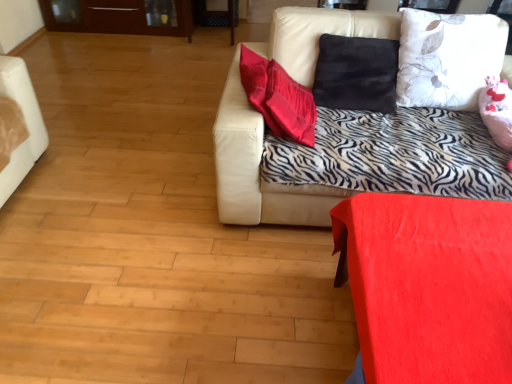
This screenshot has width=512, height=384. Identify the location of leather couch at upper right. (258, 170).

Find the location of a particular element. This screenshot has width=512, height=384. matte red table at lower right is located at coordinates (428, 286).

Locate an element on the screen. The height and width of the screenshot is (384, 512). white floral fabric pillow at upper right is located at coordinates (447, 58).

Between matte red table at lower right and white floral fabric pillow at upper right, which one appears on the left side from the viewer's perspective?

matte red table at lower right is more to the left.

Considering their positions, is matte red table at lower right located in front of or behind white floral fabric pillow at upper right?

In the image, matte red table at lower right appears in front of white floral fabric pillow at upper right.

Identify the location of furniture located below the white floral fabric pillow at upper right (from the image's perspective). (428, 286).

Would you consider matte red table at lower right to be distant from white floral fabric pillow at upper right?

No.

From the image's perspective, is white floral fabric pillow at upper right over leather couch at upper right?

Yes, from the image's perspective, white floral fabric pillow at upper right is above leather couch at upper right.

Find the location of `pillow located on the right of leather couch at upper right`. pillow located on the right of leather couch at upper right is located at coordinates (447, 58).

Consider the image. From a real-world perspective, between white floral fabric pillow at upper right and leather couch at upper right, who is vertically higher?

In real-world perspective, white floral fabric pillow at upper right is above.

Which of these two, matte red table at lower right or leather couch at upper right, is wider?

With larger width is leather couch at upper right.

Which is nearer, (374, 251) or (277, 40)?

Point (374, 251) is positioned closer to the camera compared to point (277, 40).

From a real-world perspective, between matte red table at lower right and leather couch at upper right, who is vertically higher?

leather couch at upper right is physically above.

At what (x,y) coordinates should I click in order to perform the action: click on studio couch lying above the matte red table at lower right (from the image's perspective). Please return your answer as a coordinate pair (x, y). Looking at the image, I should click on (258, 170).

From a real-world perspective, which is physically below, leather couch at upper right or white floral fabric pillow at upper right?

leather couch at upper right.

Can you confirm if leather couch at upper right is positioned to the left of white floral fabric pillow at upper right?

Yes, leather couch at upper right is to the left of white floral fabric pillow at upper right.

From their relative heights in the image, would you say leather couch at upper right is taller or shorter than white floral fabric pillow at upper right?

leather couch at upper right is taller than white floral fabric pillow at upper right.

Is white floral fabric pillow at upper right wider or thinner than matte red table at lower right?

white floral fabric pillow at upper right is thinner than matte red table at lower right.

Considering the positions of objects white floral fabric pillow at upper right and matte red table at lower right in the image provided, who is more to the left, white floral fabric pillow at upper right or matte red table at lower right?

From the viewer's perspective, matte red table at lower right appears more on the left side.

How different are the orientations of white floral fabric pillow at upper right and matte red table at lower right in degrees?

88.2 degrees separate the facing orientations of white floral fabric pillow at upper right and matte red table at lower right.

Is white floral fabric pillow at upper right bigger than matte red table at lower right?

No, white floral fabric pillow at upper right is not bigger than matte red table at lower right.

Identify the location of furniture located in front of the leather couch at upper right. The width and height of the screenshot is (512, 384). (428, 286).

From a real-world perspective, is leather couch at upper right physically below matte red table at lower right?

No, from a real-world perspective, leather couch at upper right is not beneath matte red table at lower right.

Does leather couch at upper right have a greater height compared to matte red table at lower right?

Indeed, leather couch at upper right has a greater height compared to matte red table at lower right.

Locate an element on the screen. The width and height of the screenshot is (512, 384). furniture located underneath the white floral fabric pillow at upper right (from a real-world perspective) is located at coordinates (428, 286).

Where is `studio couch that is on the left side of white floral fabric pillow at upper right`? The image size is (512, 384). studio couch that is on the left side of white floral fabric pillow at upper right is located at coordinates (258, 170).

Estimate the real-world distances between objects in this image. Which object is closer to leather couch at upper right, white floral fabric pillow at upper right or matte red table at lower right?

Based on the image, white floral fabric pillow at upper right appears to be nearer to leather couch at upper right.

Based on their spatial positions, is leather couch at upper right or matte red table at lower right further from white floral fabric pillow at upper right?

matte red table at lower right lies further to white floral fabric pillow at upper right than the other object.

Which object lies further to the anchor point matte red table at lower right, leather couch at upper right or white floral fabric pillow at upper right?

white floral fabric pillow at upper right lies further to matte red table at lower right than the other object.

Based on the photo, looking at the image, which one is located further to leather couch at upper right, matte red table at lower right or white floral fabric pillow at upper right?

Based on the image, matte red table at lower right appears to be further to leather couch at upper right.

Looking at the image, which one is located closer to white floral fabric pillow at upper right, matte red table at lower right or leather couch at upper right?

leather couch at upper right lies closer to white floral fabric pillow at upper right than the other object.

Looking at this image, from the image, which object appears to be nearer to matte red table at lower right, white floral fabric pillow at upper right or leather couch at upper right?

The object closer to matte red table at lower right is leather couch at upper right.

Find the location of `studio couch that lies between white floral fabric pillow at upper right and matte red table at lower right from top to bottom`. studio couch that lies between white floral fabric pillow at upper right and matte red table at lower right from top to bottom is located at coordinates (258, 170).